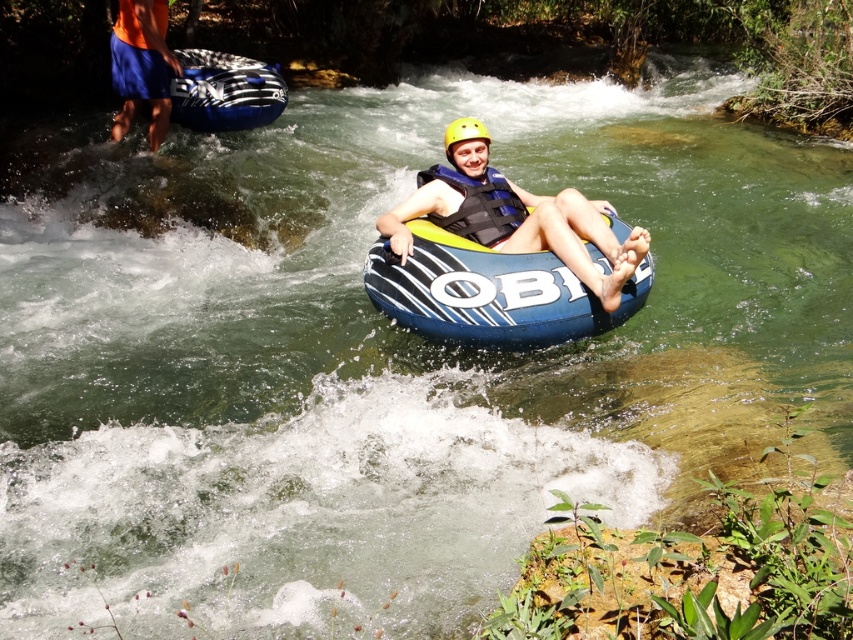
You are a photographer trying to capture the person in the orange fabric shorts at upper left. Based on their position, which direction should you move to get them centered in your shot?

The orange fabric shorts at upper left is located at point (141,65), so you should move your camera to the right and upwards to center the orange fabric shorts at upper left in your shot.

You are a river safety inspector assessing the scene. You notice the matte blue tube at center and the orange fabric shorts at upper left. Which object is shorter in height?

The matte blue tube at center is not as tall as the orange fabric shorts at upper left, so the matte blue tube at center is shorter in height.